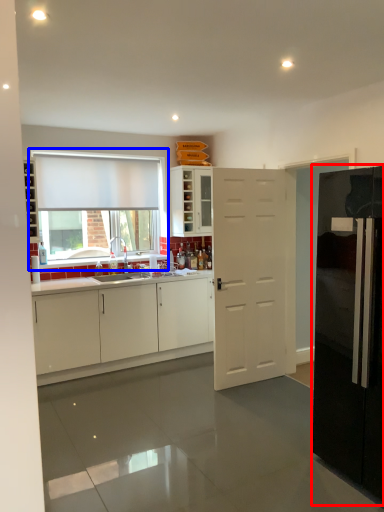
Question: Which of the following is the farthest to the observer, refrigerator (highlighted by a red box) or window (highlighted by a blue box)?

Choices:
 (A) refrigerator
 (B) window

Answer: (B)